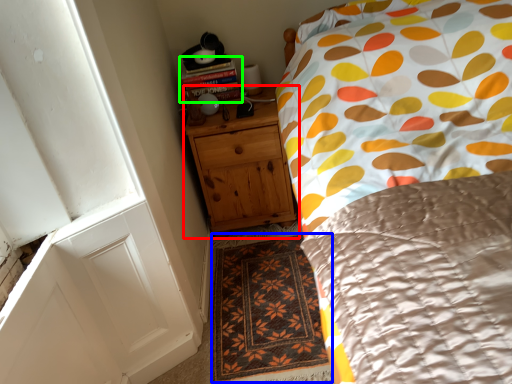
Question: Which object is the farthest from chest of drawers (highlighted by a red box)? Choose among these: doormat (highlighted by a blue box) or book (highlighted by a green box).

Choices:
 (A) doormat
 (B) book

Answer: (A)